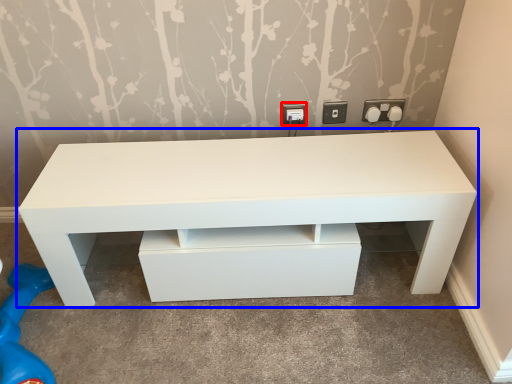
Question: Which point is closer to the camera, electric outlet (highlighted by a red box) or table (highlighted by a blue box)?

Choices:
 (A) electric outlet
 (B) table

Answer: (B)